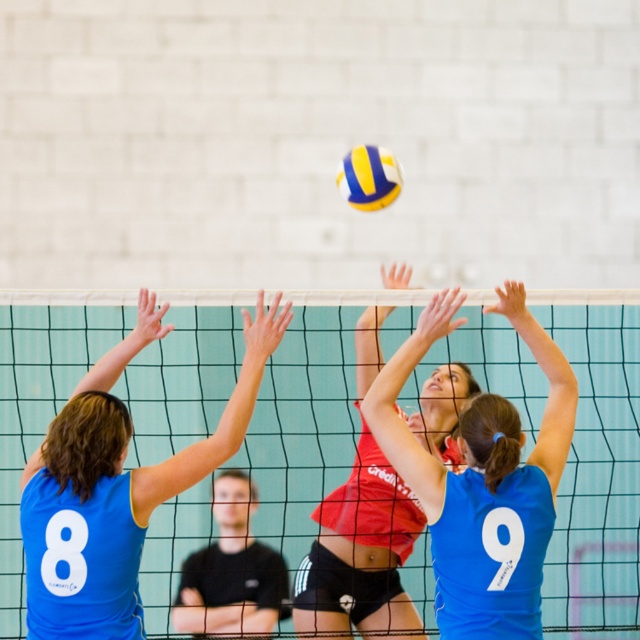
Question: Is red jersey volleyball player at center wider than red jersey at center?

Choices:
 (A) no
 (B) yes

Answer: (A)

Question: Is the position of blue jersey at center less distant than that of yellowmaterial/texturevolleyball at upper center?

Choices:
 (A) no
 (B) yes

Answer: (B)

Question: Is red jersey at center bigger than yellowmaterial/texturevolleyball at upper center?

Choices:
 (A) no
 (B) yes

Answer: (B)

Question: Which object appears farthest from the camera in this image?

Choices:
 (A) green mesh net at center
 (B) red jersey volleyball player at center
 (C) yellowmaterial/texturevolleyball at upper center

Answer: (A)

Question: Which of these objects is positioned farthest from the green mesh net at center?

Choices:
 (A) yellowmaterial/texturevolleyball at upper center
 (B) red jersey at center
 (C) red jersey volleyball player at center

Answer: (C)

Question: Which is farther from the blue jersey at center?

Choices:
 (A) yellowmaterial/texturevolleyball at upper center
 (B) green mesh net at center

Answer: (B)